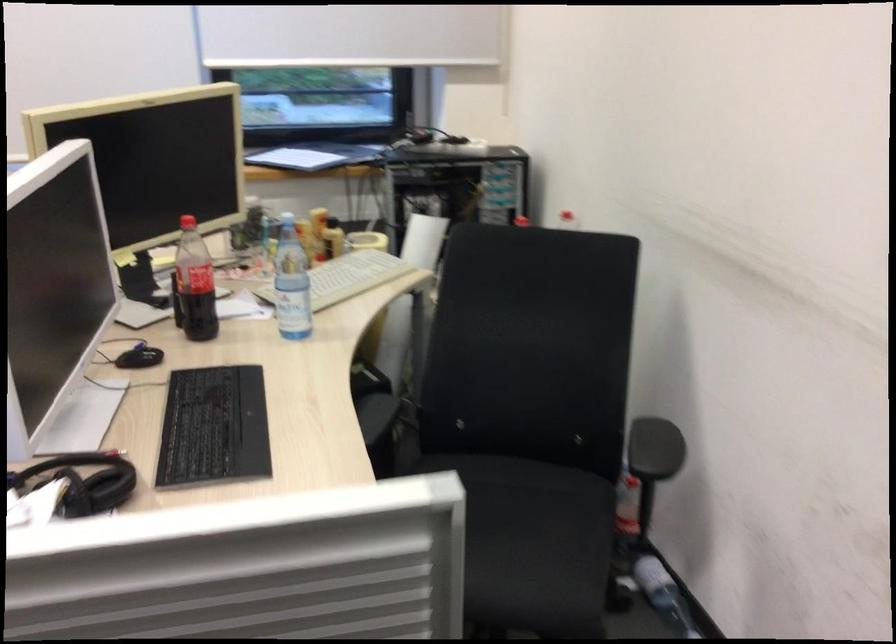
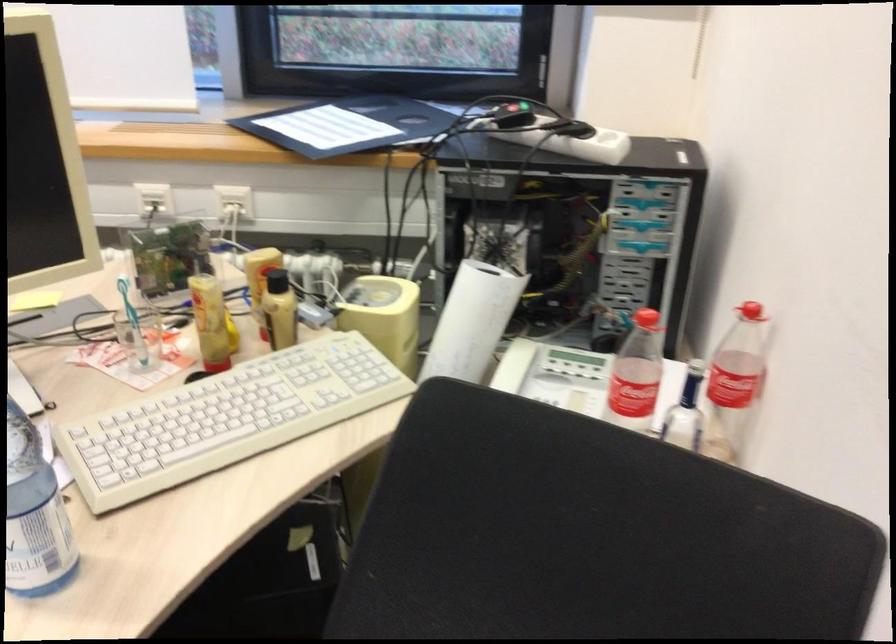
Question: In a continuous first-person perspective shot, in which direction is the camera moving?

Choices:
 (A) Left
 (B) Right
 (C) Forward
 (D) Backward

Answer: (C)